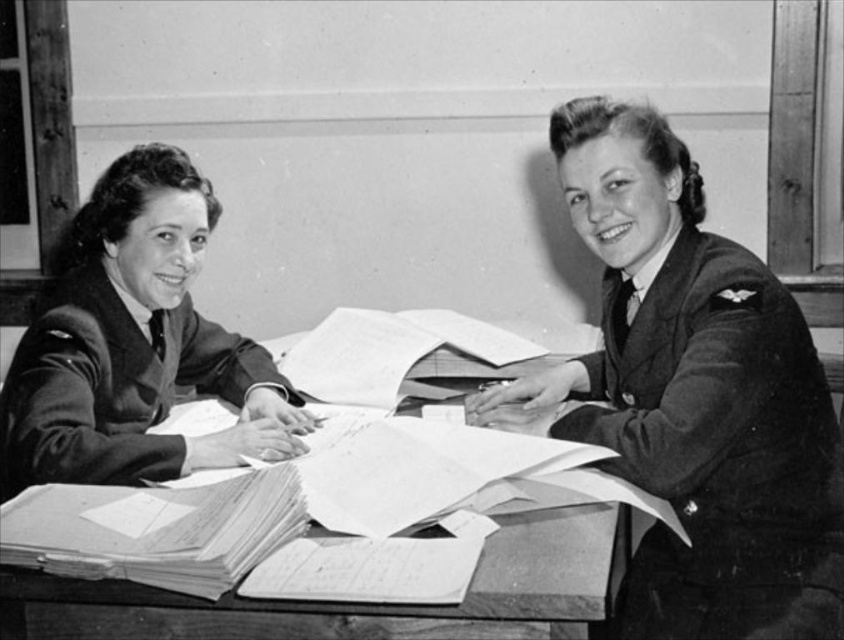
Question: Does smooth fabric uniform at left lie behind wooden table at center?

Choices:
 (A) no
 (B) yes

Answer: (B)

Question: Can you confirm if uniformed woman at center is positioned to the right of wooden table at center?

Choices:
 (A) no
 (B) yes

Answer: (B)

Question: Is the position of uniformed woman at center more distant than that of wooden table at center?

Choices:
 (A) yes
 (B) no

Answer: (A)

Question: Among these objects, which one is nearest to the camera?

Choices:
 (A) uniformed woman at center
 (B) smooth fabric uniform at left
 (C) wooden table at center

Answer: (C)

Question: Which point is farther from the camera taking this photo?

Choices:
 (A) (65, 288)
 (B) (586, 394)
 (C) (485, 608)

Answer: (B)

Question: Which of the following is the closest to the observer?

Choices:
 (A) (685, 150)
 (B) (161, 442)
 (C) (306, 636)

Answer: (C)